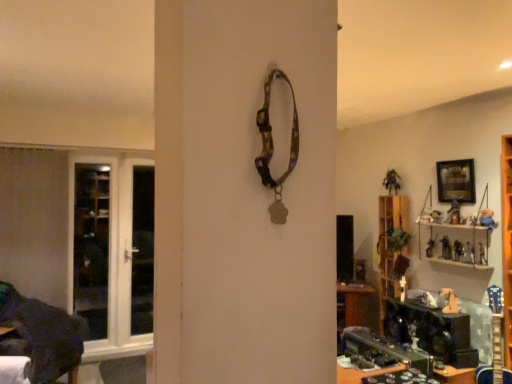
Question: Can you confirm if wooden shelf at right is thinner than wooden framed picture at upper right?

Choices:
 (A) no
 (B) yes

Answer: (A)

Question: Is wooden shelf at right wider than wooden framed picture at upper right?

Choices:
 (A) no
 (B) yes

Answer: (B)

Question: Is wooden shelf at right taller than wooden framed picture at upper right?

Choices:
 (A) yes
 (B) no

Answer: (A)

Question: Considering the relative positions of wooden shelf at right and wooden framed picture at upper right in the image provided, is wooden shelf at right in front of wooden framed picture at upper right?

Choices:
 (A) yes
 (B) no

Answer: (A)

Question: Is wooden shelf at right at the right side of wooden framed picture at upper right?

Choices:
 (A) no
 (B) yes

Answer: (A)

Question: Relative to wooden framed picture at upper right, is wooden shelf at right in front or behind?

Choices:
 (A) front
 (B) behind

Answer: (A)

Question: In terms of height, does wooden shelf at right look taller or shorter compared to wooden framed picture at upper right?

Choices:
 (A) tall
 (B) short

Answer: (A)

Question: Is wooden shelf at right to the left or to the right of wooden framed picture at upper right in the image?

Choices:
 (A) left
 (B) right

Answer: (A)

Question: Would you say wooden shelf at right is inside or outside wooden framed picture at upper right?

Choices:
 (A) inside
 (B) outside

Answer: (B)

Question: From a real-world perspective, relative to white glossy door at left, is wooden shelf at right vertically above or below?

Choices:
 (A) below
 (B) above

Answer: (B)

Question: Is wooden shelf at right to the left or to the right of white glossy door at left in the image?

Choices:
 (A) left
 (B) right

Answer: (B)

Question: Is point (458, 251) positioned closer to the camera than point (125, 221)?

Choices:
 (A) closer
 (B) farther

Answer: (A)

Question: Looking at their shapes, would you say wooden shelf at right is wider or thinner than white glossy door at left?

Choices:
 (A) thin
 (B) wide

Answer: (B)

Question: Considering the positions of wooden framed picture at upper right and wooden shelf at right in the image, is wooden framed picture at upper right taller or shorter than wooden shelf at right?

Choices:
 (A) short
 (B) tall

Answer: (A)

Question: Considering the positions of point (443, 201) and point (440, 244), is point (443, 201) closer or farther from the camera than point (440, 244)?

Choices:
 (A) closer
 (B) farther

Answer: (A)